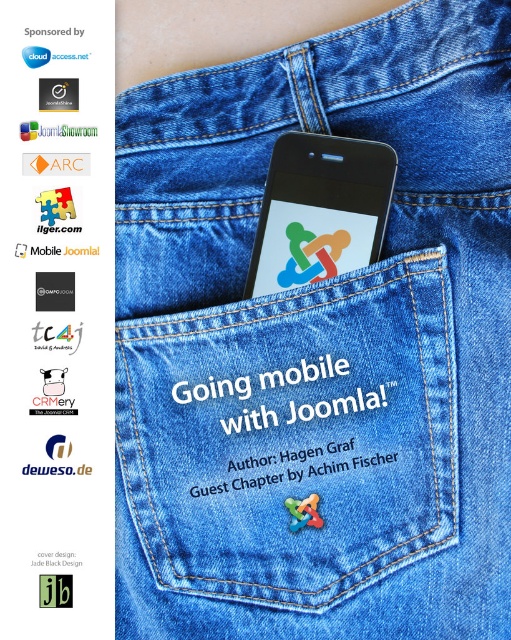
Question: Which point is farther from the camera taking this photo?

Choices:
 (A) click(390, 173)
 (B) click(308, 451)

Answer: (B)

Question: Which of the following is the closest to the observer?

Choices:
 (A) (323, 465)
 (B) (346, 264)

Answer: (A)

Question: Does black glossy smartphone at center have a smaller size compared to green matte joomla logo at center?

Choices:
 (A) yes
 (B) no

Answer: (B)

Question: Can you confirm if black glossy smartphone at center is positioned below green matte joomla logo at center?

Choices:
 (A) yes
 (B) no

Answer: (B)

Question: Where is black glossy smartphone at center located in relation to green matte joomla logo at center in the image?

Choices:
 (A) below
 (B) above

Answer: (B)